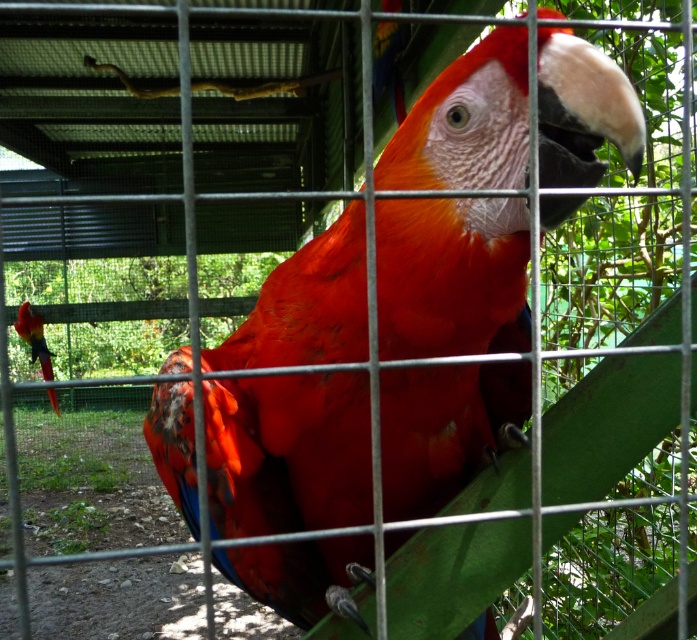
Based on the scene description, where is the glossy feathers parrot at center positioned in relation to the cage?

The glossy feathers parrot at center is located at point [286,452] inside the cage.

You are an animal caretaker observing two parrots in a cage. You see a glossy feathers parrot at center and a shiny red parrot at left. Which parrot has a smaller width?

The glossy feathers parrot at center has a smaller width than the shiny red parrot at left.